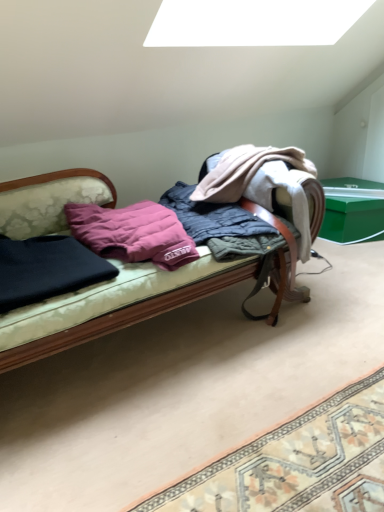
What are the coordinates of `vacant space underneath patterned fabric mat at lower right (from a real-world perspective)` in the screenshot? It's located at (314, 456).